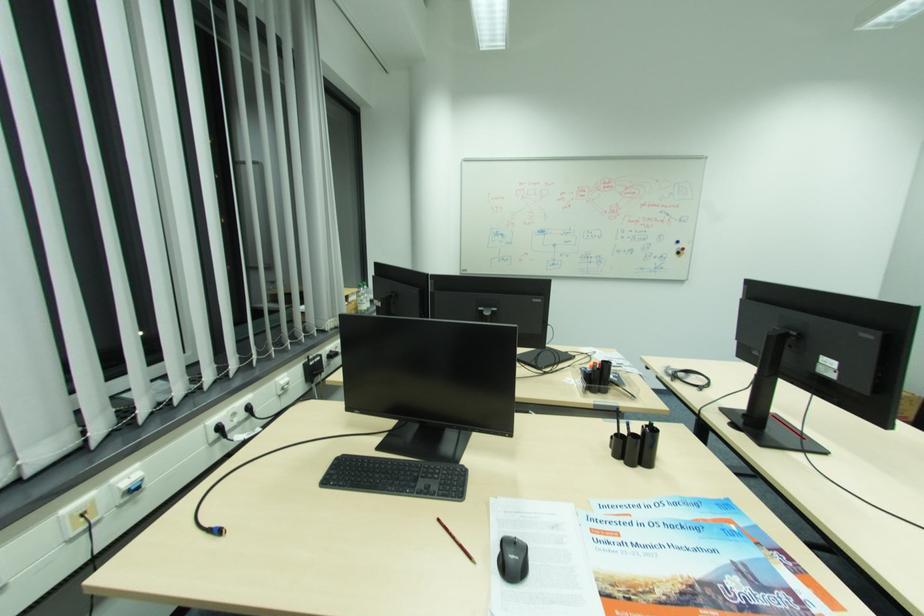
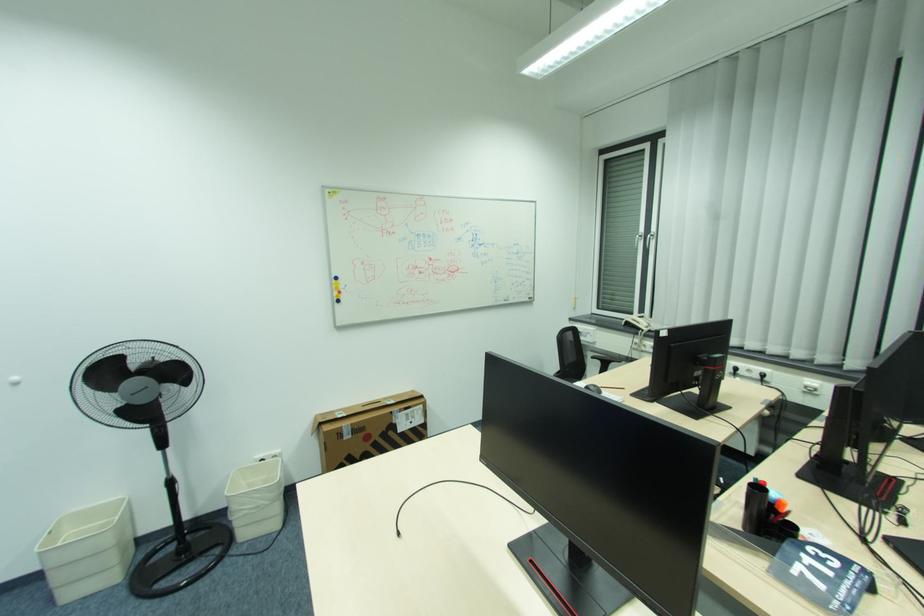
Question: I am providing you with two images of the same scene from different viewpoints. After the viewpoint changes to image2, which objects are now occluded?

Choices:
 (A) kitchen faucet handle
 (B) black computer mouse
 (C) blue whiteboard magnet
 (D) black pen

Answer: (D)